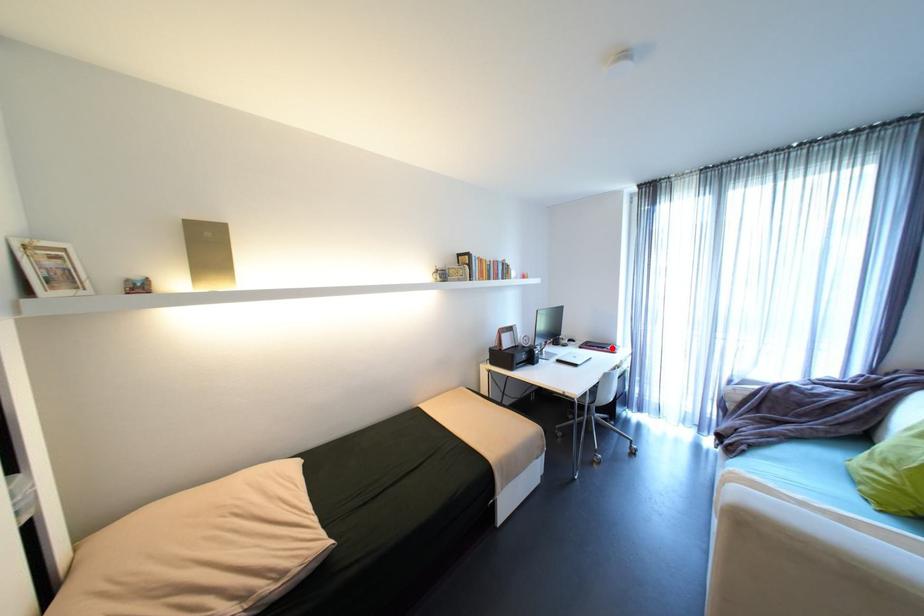
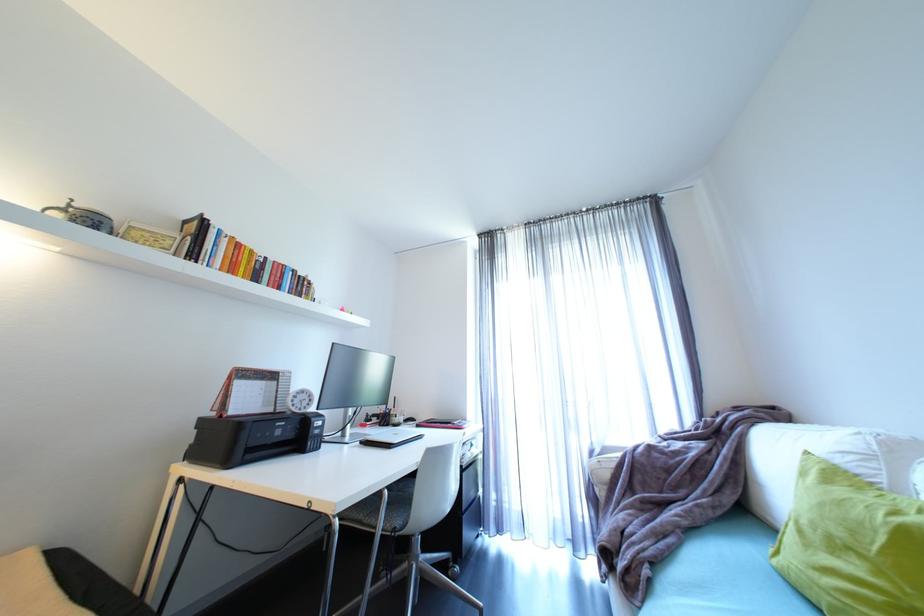
Find the pixel in the second image that matches the highlighted location in the first image.

(457, 424)